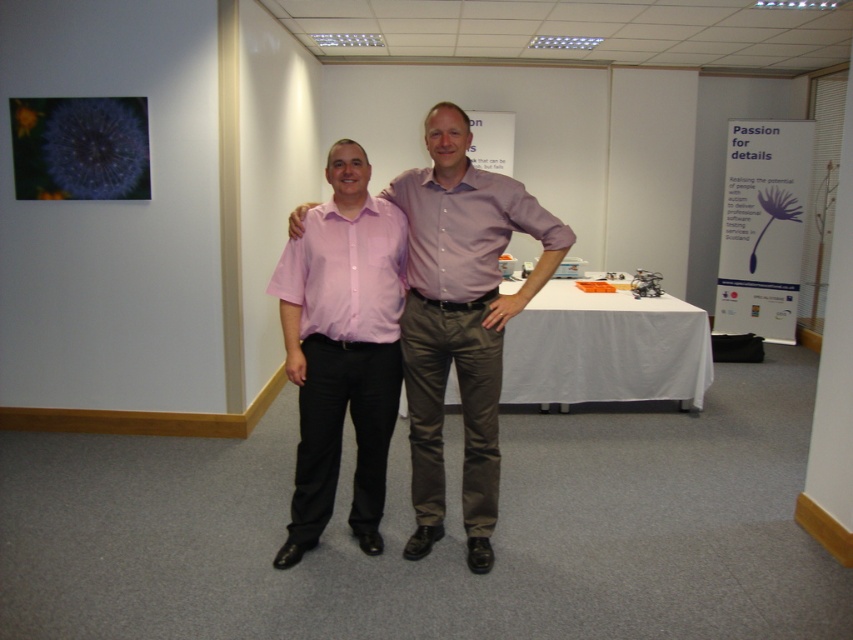
Question: Which of the following is the farthest from the observer?

Choices:
 (A) matte purple shirt at center
 (B) white cloth at center
 (C) pink glossy shirt at center

Answer: (B)

Question: Does pink glossy shirt at center come in front of pink smooth shirt at center?

Choices:
 (A) yes
 (B) no

Answer: (B)

Question: Can you confirm if pink cotton shirt at center is smaller than white cloth at center?

Choices:
 (A) yes
 (B) no

Answer: (A)

Question: Among these points, which one is nearest to the camera?

Choices:
 (A) (329, 208)
 (B) (358, 272)
 (C) (503, 225)

Answer: (B)

Question: Which object appears farthest from the camera in this image?

Choices:
 (A) pink glossy shirt at center
 (B) pink smooth shirt at center

Answer: (A)

Question: Is pink cotton shirt at center thinner than matte purple shirt at center?

Choices:
 (A) yes
 (B) no

Answer: (A)